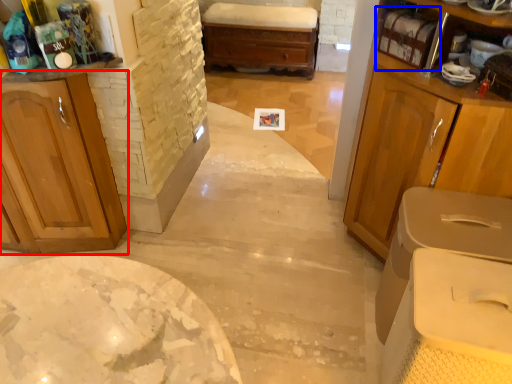
Question: Among these objects, which one is farthest to the camera, cabinetry (highlighted by a red box) or shelf (highlighted by a blue box)?

Choices:
 (A) cabinetry
 (B) shelf

Answer: (B)